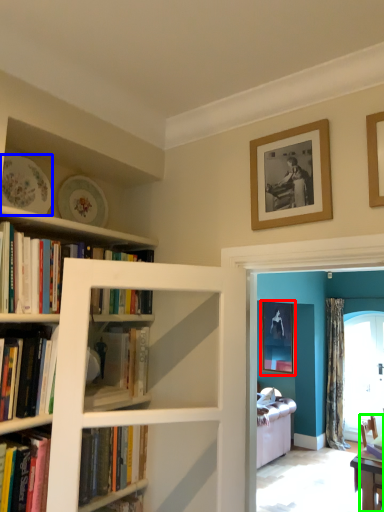
Question: Estimate the real-world distances between objects in this image. Which object is closer to picture frame (highlighted by a red box), plate (highlighted by a blue box) or chair (highlighted by a green box)?

Choices:
 (A) plate
 (B) chair

Answer: (B)